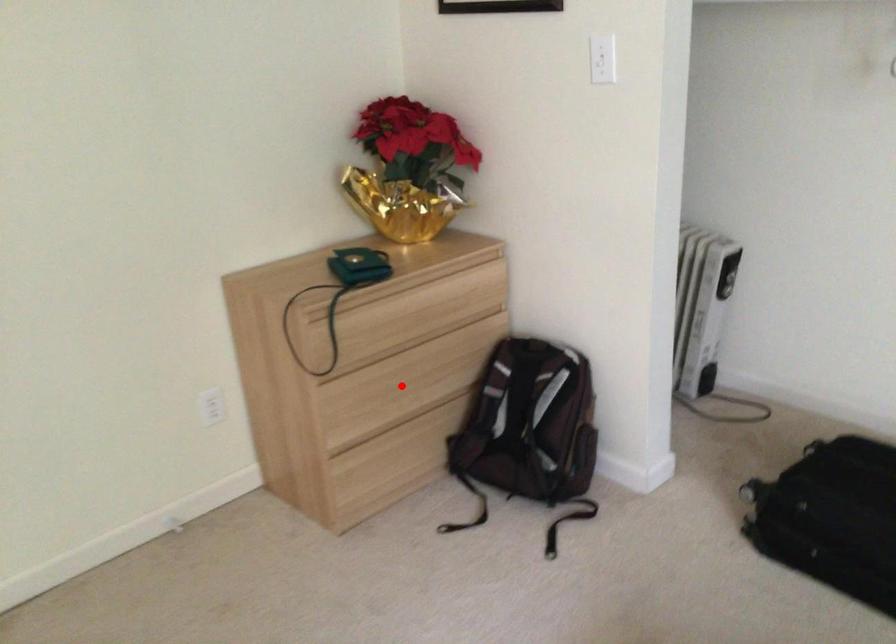
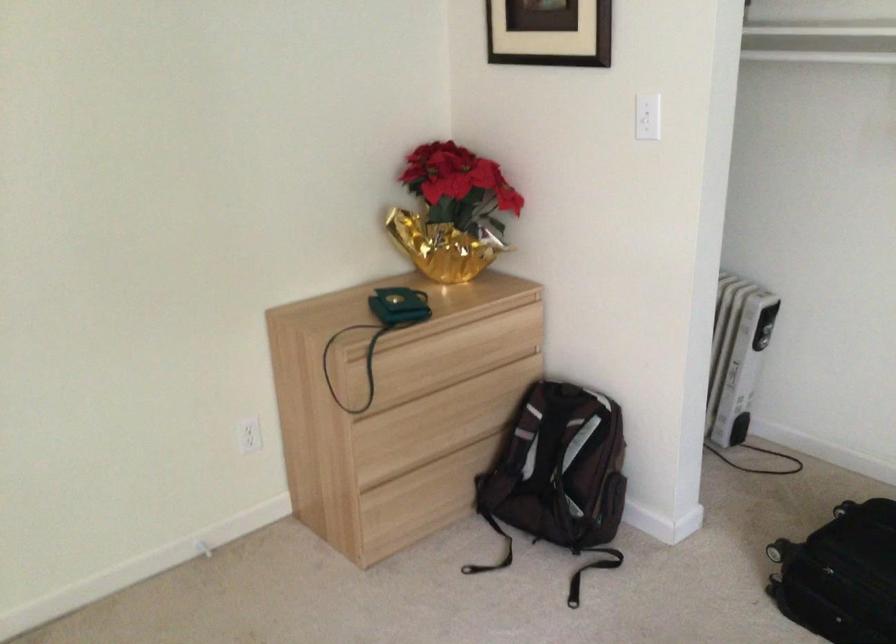
Where in the second image is the point corresponding to the highlighted location from the first image?

(434, 424)